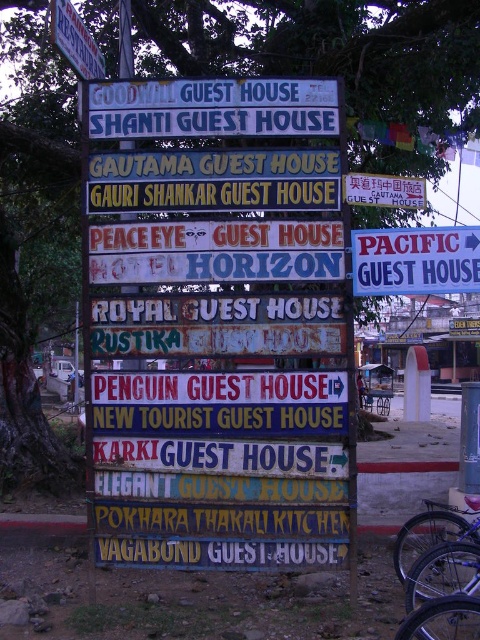
In the scene shown: You are a tourist trying to find the direction to the guest houses. You see the white plastic sign at right and the brushed metal sign at upper left. Which sign is positioned lower on the signboard?

The white plastic sign at right is located below the brushed metal sign at upper left, so it is positioned lower on the signboard.

You are a tourist trying to read the signs on the multi tiered signboard. Which sign has a greater width between the white painted wood sign at upper center and the brushed metal sign at upper left?

The white painted wood sign at upper center has a greater width than the brushed metal sign at upper left.

You are a delivery person trying to determine the best path to reach the restaurant mentioned on the white plastic sign at right and the guest house on the brushed metal sign at upper left. Which sign should you look at first to find the direction to the restaurant?

You should look at the white plastic sign at right first because it mentions the restaurant, so the directional arrow there will guide you to the Pokhara Thakali Kitchen restaurant.